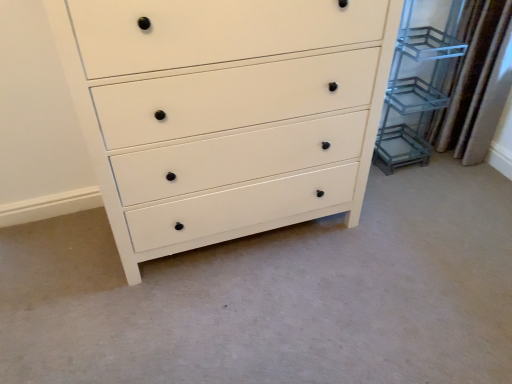
Question: Is clear glass shelving unit at right inside or outside of white matte chest of drawers at center?

Choices:
 (A) outside
 (B) inside

Answer: (A)

Question: From a real-world perspective, is clear glass shelving unit at right above or below white matte chest of drawers at center?

Choices:
 (A) above
 (B) below

Answer: (B)

Question: Considering the real-world distances, which object is farthest from the brown textured curtain at right?

Choices:
 (A) white matte chest of drawers at center
 (B) clear glass shelving unit at right

Answer: (A)

Question: Which object is the farthest from the clear glass shelving unit at right?

Choices:
 (A) brown textured curtain at right
 (B) white matte chest of drawers at center

Answer: (B)